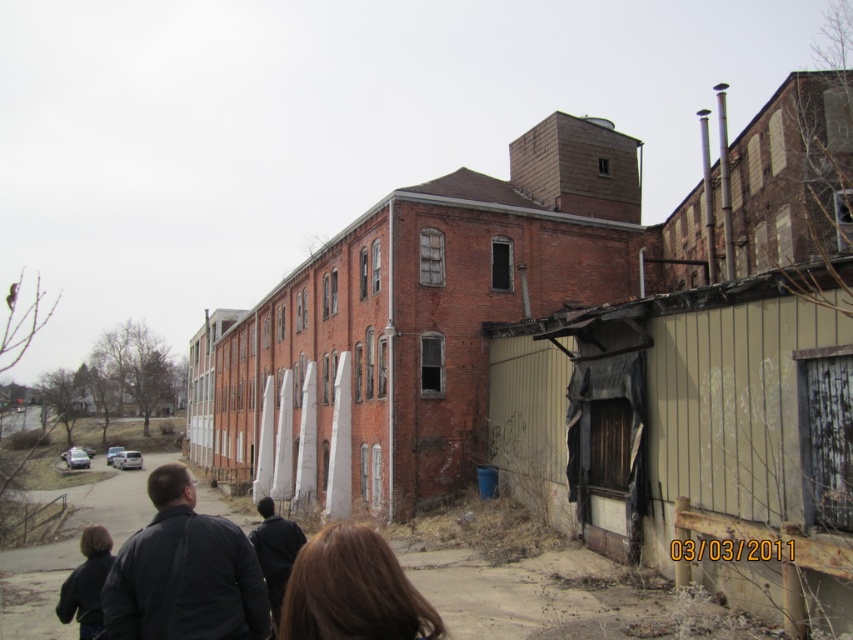
Question: Which point is farther to the camera?

Choices:
 (A) brown hair at lower center
 (B) dark gray jacket at lower left

Answer: (B)

Question: Which point is farther to the camera?

Choices:
 (A) dark blue jacket at lower center
 (B) dark gray jacket at lower left

Answer: (A)

Question: Does dark gray jacket at lower left have a greater width compared to dark brown leather jacket at lower left?

Choices:
 (A) yes
 (B) no

Answer: (B)

Question: Which is nearer to the dark blue jacket at lower center?

Choices:
 (A) dark gray jacket at lower left
 (B) brown hair at lower center

Answer: (A)

Question: Can you confirm if dark brown leather jacket at lower left is positioned above dark blue jacket at lower center?

Choices:
 (A) yes
 (B) no

Answer: (B)

Question: Does dark gray jacket at lower left have a greater width compared to brown hair at lower center?

Choices:
 (A) no
 (B) yes

Answer: (B)